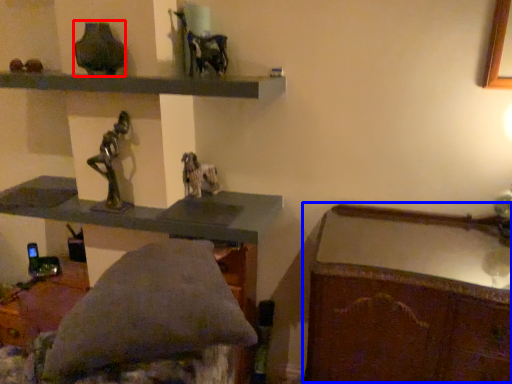
Question: Which of the following is the farthest to the observer, vase (highlighted by a red box) or writing desk (highlighted by a blue box)?

Choices:
 (A) vase
 (B) writing desk

Answer: (A)